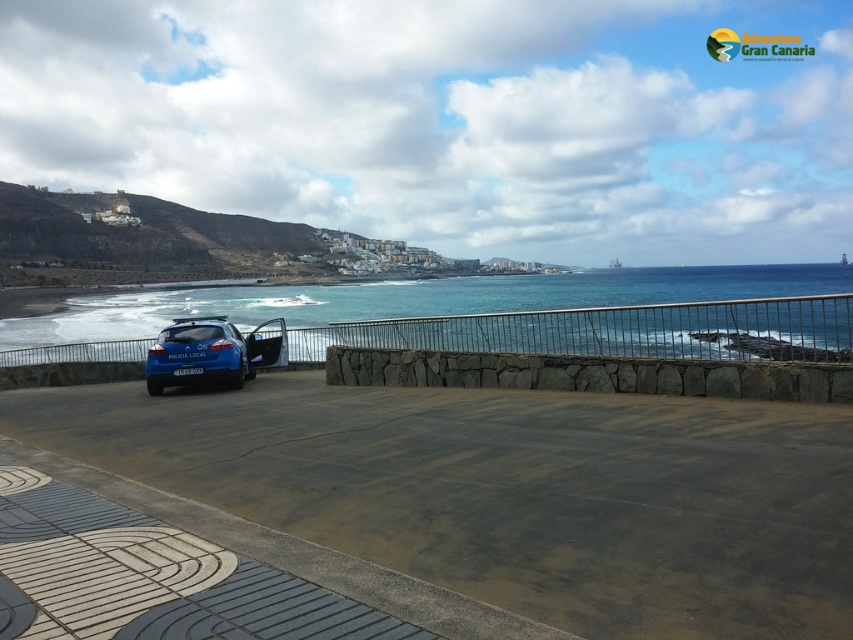
You are a tourist visiting the coastal area and want to take a photo of the blue water at center and the blue matte police car at center. Which one should you focus on first if you want to capture both in the same frame without moving the camera?

The blue water at center has a larger size compared to the blue matte police car at center, so you should focus on the blue water at center first to ensure it fits properly in the frame.